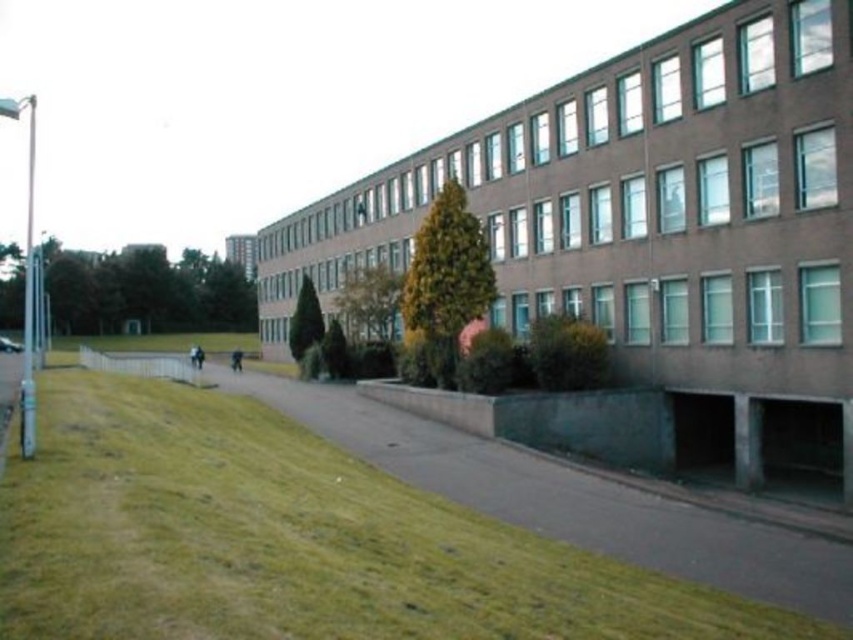
You are standing in front of the building and want to walk towards the green grass at lower left and the green grass at center. Which grass area will you reach first?

The green grass at lower left is closer to the viewer than the green grass at center, so you will reach the green grass at lower left first.

You are a groundskeeper planning to mow the green grass at lower left and the green grass at center. Which area requires more time to mow based on their sizes?

The green grass at center requires more time to mow because it occupies more space than the green grass at lower left.

You are standing at the entrance of the building and want to walk to the green grass at lower left. Which direction should you turn from the green grass at center to reach your destination?

To reach the green grass at lower left from the green grass at center, you should turn right because the green grass at lower left is located to the right of the green grass at center.